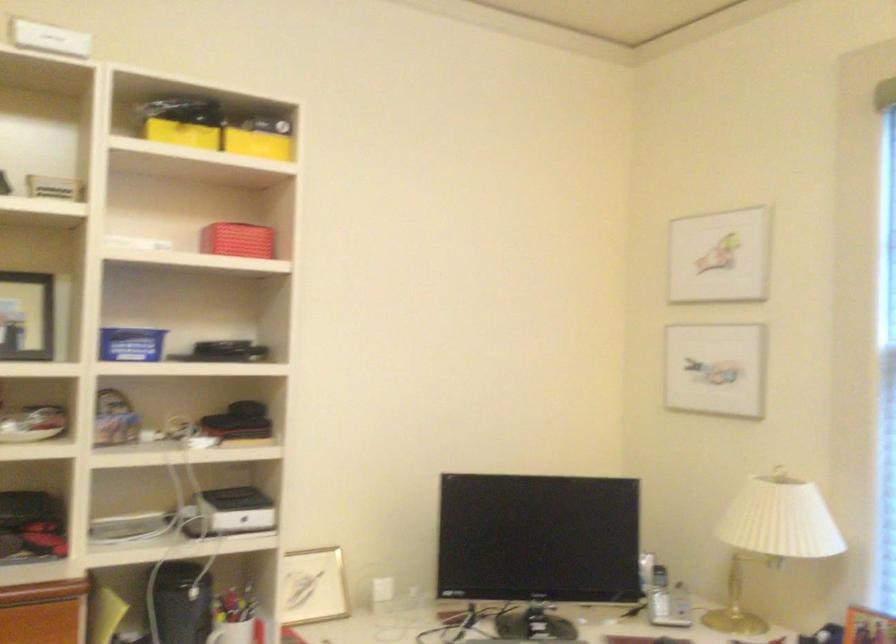
Find where to lift the blue plastic container. Please return your answer as a coordinate pair (x, y).

(131, 344)